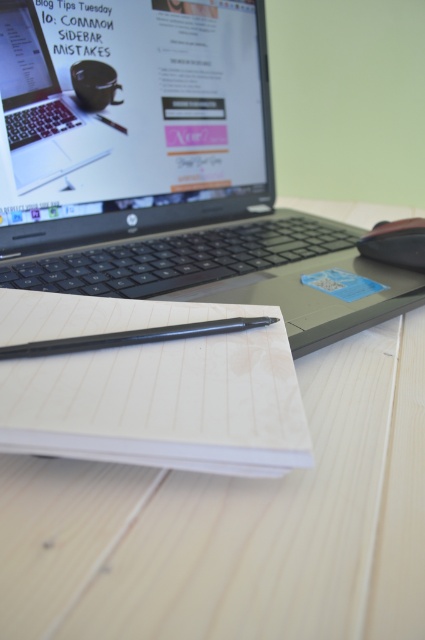
Question: Is white paper notebook at center smaller than black plastic mouse at right?

Choices:
 (A) yes
 (B) no

Answer: (B)

Question: Which object appears closest to the camera in this image?

Choices:
 (A) light wood table at center
 (B) black glossy pen at center

Answer: (A)

Question: Is light wood table at center wider than black plastic mouse at right?

Choices:
 (A) yes
 (B) no

Answer: (A)

Question: Which of the following is the farthest from the observer?

Choices:
 (A) (84, 161)
 (B) (203, 349)
 (C) (139, 493)

Answer: (A)

Question: In this image, where is white paper notebook at center located relative to black glossy pen at center?

Choices:
 (A) above
 (B) below

Answer: (B)

Question: Which point appears closest to the camera in this image?

Choices:
 (A) (169, 333)
 (B) (396, 253)

Answer: (A)